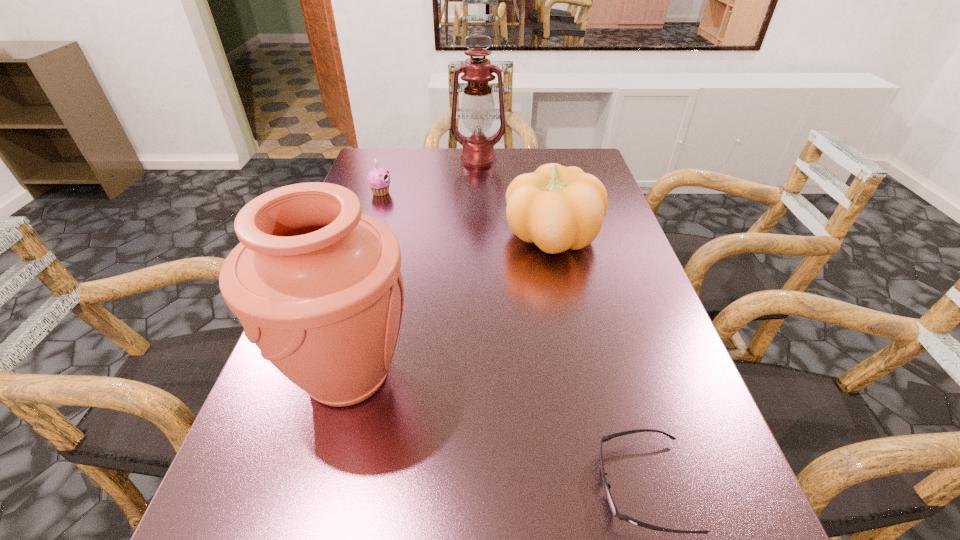
Where is `free spot between the second farthest object and the oil lamp`? The width and height of the screenshot is (960, 540). free spot between the second farthest object and the oil lamp is located at coordinates (429, 176).

Find the location of a particular element. The height and width of the screenshot is (540, 960). vacant area that lies between the oil lamp and the cupcake is located at coordinates pos(429,176).

Where is `free point between the cupcake and the farthest object`? free point between the cupcake and the farthest object is located at coordinates (429, 176).

You are a GUI agent. You are given a task and a screenshot of the screen. Output one action in this format:
    pyautogui.click(x=<x>, y=<y>)
    Task: Click on the object that can be found as the closest to the second nearest object
    This screenshot has width=960, height=540.
    Given the screenshot: What is the action you would take?
    pyautogui.click(x=558, y=208)

Image resolution: width=960 pixels, height=540 pixels. What are the coordinates of `object identified as the third closest to the second farthest object` in the screenshot? It's located at (317, 285).

At what (x,y) coordinates should I click in order to perform the action: click on free space that satisfies the following two spatial constraints: 1. on the back side of the vase; 2. on the left side of the farthest object. Please return your answer as a coordinate pair (x, y). Looking at the image, I should click on (407, 160).

The image size is (960, 540). I want to click on free location that satisfies the following two spatial constraints: 1. on the back side of the farthest object; 2. on the left side of the vase, so click(x=407, y=160).

You are a GUI agent. You are given a task and a screenshot of the screen. Output one action in this format:
    pyautogui.click(x=<x>, y=<y>)
    Task: Click on the free space in the image that satisfies the following two spatial constraints: 1. on the back side of the vase; 2. on the right side of the third shortest object
    The height and width of the screenshot is (540, 960).
    Given the screenshot: What is the action you would take?
    pyautogui.click(x=386, y=237)

Find the location of `blank area in the image that satisfies the following two spatial constraints: 1. on the face of the cupcake; 2. on the right side of the fourth farthest object`. blank area in the image that satisfies the following two spatial constraints: 1. on the face of the cupcake; 2. on the right side of the fourth farthest object is located at coordinates (321, 375).